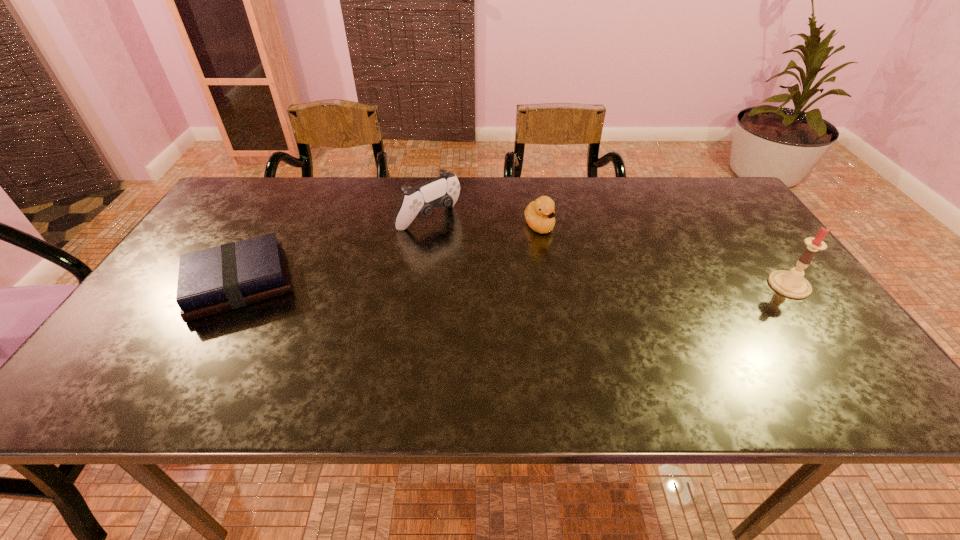
Locate an element on the screen. This screenshot has width=960, height=540. vacant region at the far edge is located at coordinates (341, 189).

I want to click on vacant space at the left edge, so click(x=256, y=224).

Locate an element on the screen. vacant area at the right edge is located at coordinates (773, 299).

The width and height of the screenshot is (960, 540). In the image, there is a desktop. Identify the location of blank space at the far right corner. (703, 188).

Find the location of a particular element. vacant area that lies between the third tallest object and the leftmost object is located at coordinates (389, 255).

Where is `vacant space that's between the third object from left to right and the book`? vacant space that's between the third object from left to right and the book is located at coordinates (389, 255).

I want to click on blank region between the candle and the book, so click(x=515, y=285).

The image size is (960, 540). In order to click on vacant area between the second object from left to right and the rightmost object in this screenshot , I will do `click(609, 252)`.

Where is `vacant space that is in between the leftmost object and the second object from right to left`? vacant space that is in between the leftmost object and the second object from right to left is located at coordinates (389, 255).

Locate an element on the screen. empty space between the book and the third object from left to right is located at coordinates (389, 255).